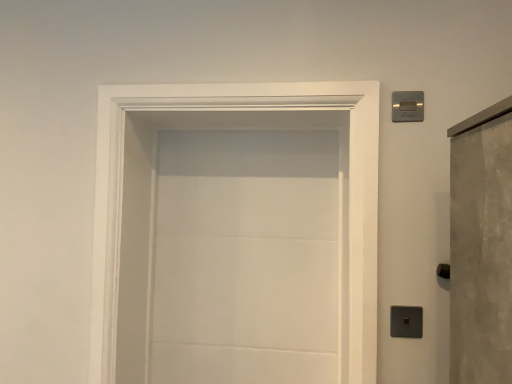
Measure the distance between point (410, 104) and camera.

Point (410, 104) is 4.05 feet from camera.

What is the approximate width of satin silver switch at upper right?

It is 0.39 inches.

The width and height of the screenshot is (512, 384). Find the location of `satin silver switch at upper right`. satin silver switch at upper right is located at coordinates (407, 106).

What do you see at coordinates (407, 106) in the screenshot?
I see `satin silver switch at upper right` at bounding box center [407, 106].

In order to face satin silver switch at upper right, should I rotate leftwards or rightwards?

Rotate right and turn 19.565 degrees.

What is the approximate width of white matte door at center?

The width of white matte door at center is 30.83 centimeters.

Locate an element on the screen. The image size is (512, 384). white matte door at center is located at coordinates (154, 189).

What do you see at coordinates (154, 189) in the screenshot? I see `white matte door at center` at bounding box center [154, 189].

At what (x,y) coordinates should I click in order to perform the action: click on satin silver switch at upper right. Please return your answer as a coordinate pair (x, y). Looking at the image, I should click on (407, 106).

Is satin silver switch at upper right to the left of white matte door at center from the viewer's perspective?

No.

Is satin silver switch at upper right in front of or behind white matte door at center in the image?

Visually, satin silver switch at upper right is located behind white matte door at center.

Which point is more forward, (x=403, y=116) or (x=130, y=274)?

→ Positioned in front is point (x=403, y=116).

From the image's perspective, between satin silver switch at upper right and white matte door at center, which one is located above?

satin silver switch at upper right appears higher in the image.

From a real-world perspective, is satin silver switch at upper right beneath white matte door at center?

No, from a real-world perspective, satin silver switch at upper right is not under white matte door at center.

Based on the photo, does satin silver switch at upper right have a lesser width compared to white matte door at center?

Yes, satin silver switch at upper right is thinner than white matte door at center.

Who is shorter, satin silver switch at upper right or white matte door at center?

satin silver switch at upper right.

Can you confirm if satin silver switch at upper right is bigger than white matte door at center?

No, satin silver switch at upper right is not bigger than white matte door at center.

Is satin silver switch at upper right located outside white matte door at center?

Yes, satin silver switch at upper right is located beyond the bounds of white matte door at center.

Are satin silver switch at upper right and white matte door at center making contact?

No.

Could you tell me if satin silver switch at upper right is turned towards white matte door at center?

No.

What's the angular difference between satin silver switch at upper right and white matte door at center's facing directions?

The angular difference between satin silver switch at upper right and white matte door at center is 7.13 degrees.

Locate an element on the screen. light switch above the white matte door at center (from a real-world perspective) is located at coordinates (407, 106).

Between white matte door at center and satin silver switch at upper right, which one appears on the left side from the viewer's perspective?

Positioned to the left is white matte door at center.

Considering the relative positions of white matte door at center and satin silver switch at upper right in the image provided, is white matte door at center behind satin silver switch at upper right?

No, white matte door at center is in front of satin silver switch at upper right.

Does point (286, 119) come farther from viewer compared to point (405, 99)?

Yes, it is behind point (405, 99).

From the image's perspective, is white matte door at center located beneath satin silver switch at upper right?

Yes, from the image's perspective, white matte door at center is beneath satin silver switch at upper right.

From a real-world perspective, does white matte door at center stand above satin silver switch at upper right?

No, from a real-world perspective, white matte door at center is not above satin silver switch at upper right.

Which object is wider, white matte door at center or satin silver switch at upper right?

white matte door at center.

Considering the sizes of objects white matte door at center and satin silver switch at upper right in the image provided, who is shorter, white matte door at center or satin silver switch at upper right?

satin silver switch at upper right.

Looking at the image, does white matte door at center seem bigger or smaller compared to satin silver switch at upper right?

Clearly, white matte door at center is larger in size than satin silver switch at upper right.

Is white matte door at center outside of satin silver switch at upper right?

Yes, white matte door at center is located beyond the bounds of satin silver switch at upper right.

Is white matte door at center with satin silver switch at upper right?

white matte door at center and satin silver switch at upper right are clearly separated.

Is white matte door at center turned away from satin silver switch at upper right?

That's not correct — white matte door at center is not looking away from satin silver switch at upper right.

How different are the orientations of white matte door at center and satin silver switch at upper right in degrees?

7.13 degrees.

Where is `light switch on the right of white matte door at center`? Image resolution: width=512 pixels, height=384 pixels. light switch on the right of white matte door at center is located at coordinates (407, 106).

Identify the location of door on the left side of satin silver switch at upper right. The width and height of the screenshot is (512, 384). (154, 189).

I want to click on light switch above the white matte door at center (from the image's perspective), so click(x=407, y=106).